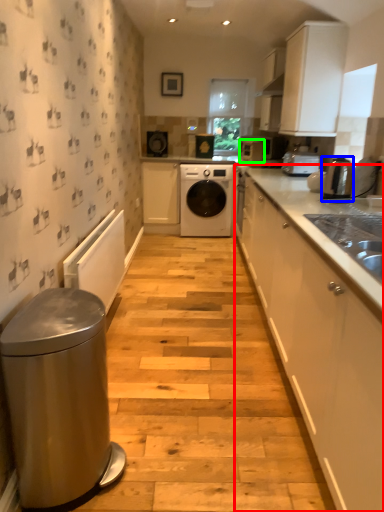
Question: Based on their relative distances, which object is nearer to cabinetry (highlighted by a red box)? Choose from home appliance (highlighted by a blue box) and appliance (highlighted by a green box).

Choices:
 (A) home appliance
 (B) appliance

Answer: (A)